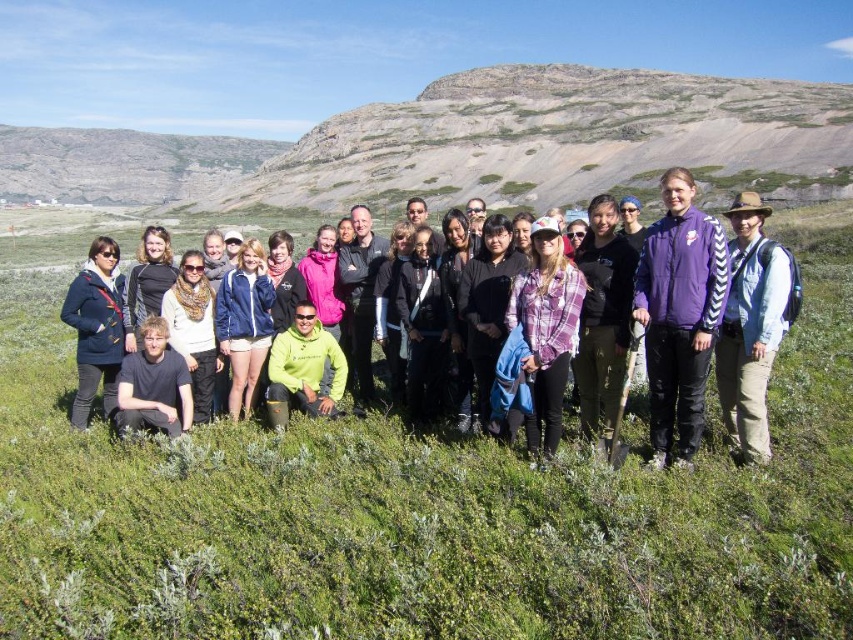
Question: Does purple fleece jacket at center appear over plaid fabric shirt at center?

Choices:
 (A) yes
 (B) no

Answer: (A)

Question: Which object is positioned farthest from the green grassy at center?

Choices:
 (A) plaid fabric shirt at center
 (B) rocky terrain at upper center

Answer: (B)

Question: Which of these objects is positioned farthest from the plaid fabric shirt at center?

Choices:
 (A) neon green fabric at center
 (B) rocky terrain at upper center
 (C) rugged stone hillside at upper left

Answer: (C)

Question: Does rocky terrain at upper center have a smaller size compared to denim jacket at center?

Choices:
 (A) no
 (B) yes

Answer: (A)

Question: Is denim jacket at center further to camera compared to neon green fabric at center?

Choices:
 (A) no
 (B) yes

Answer: (A)

Question: Which point is closer to the camera?

Choices:
 (A) matte blue jacket at center
 (B) plaid fabric shirt at center

Answer: (B)